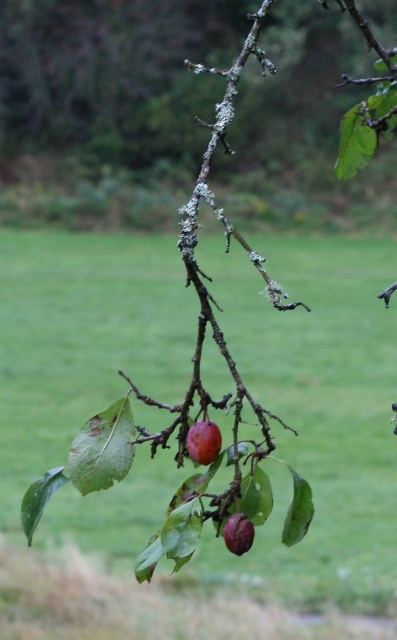
Question: Considering the real-world distances, which object is farthest from the shiny purple plum at center?

Choices:
 (A) green grass at center
 (B) shiny red plum at center

Answer: (A)

Question: Observing the image, what is the correct spatial positioning of green grass at center in reference to shiny purple plum at center?

Choices:
 (A) right
 (B) left

Answer: (B)

Question: Considering the real-world distances, which object is farthest from the shiny purple plum at center?

Choices:
 (A) green grass at center
 (B) shiny red plum at center

Answer: (A)

Question: Which point is closer to the camera?

Choices:
 (A) shiny purple plum at center
 (B) shiny red plum at center
 (C) green grass at center

Answer: (C)

Question: Does shiny red plum at center have a greater width compared to shiny purple plum at center?

Choices:
 (A) no
 (B) yes

Answer: (A)

Question: Is green grass at center bigger than shiny purple plum at center?

Choices:
 (A) yes
 (B) no

Answer: (A)